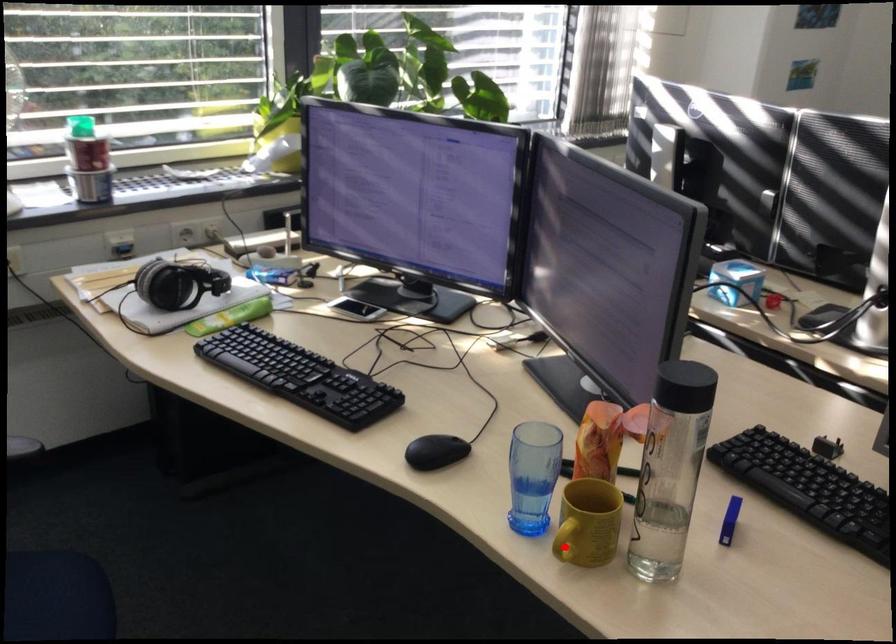
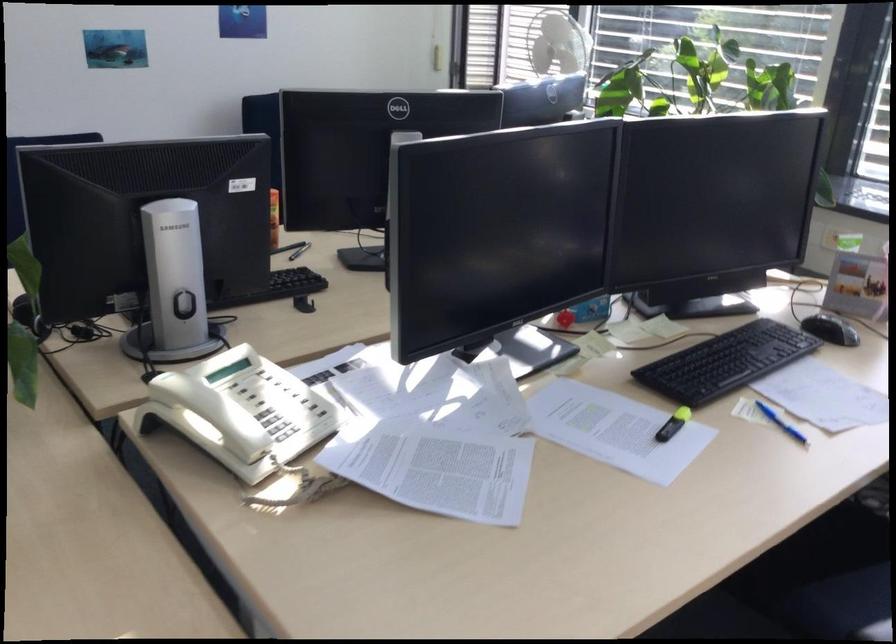
Question: I am providing you with two images of the same scene from different viewpoints. A red point is marked on the first image. At the location where the point appears in image 1, is it still visible in image 2?

Choices:
 (A) Yes
 (B) No

Answer: (B)